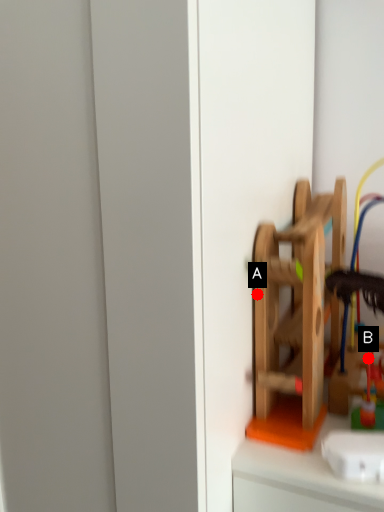
Question: Two points are circled on the image, labeled by A and B beside each circle. Which point is closer to the camera?

Choices:
 (A) A is closer
 (B) B is closer

Answer: (A)